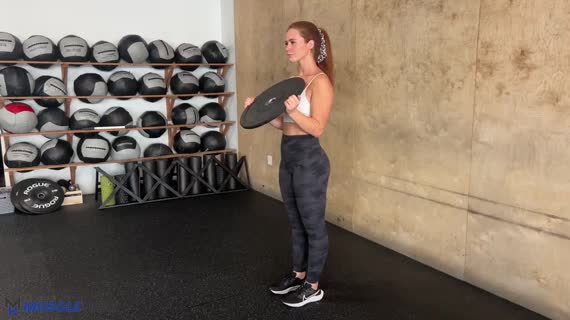
You are a GUI agent. You are given a task and a screenshot of the screen. Output one action in this format:
    pyautogui.click(x=<x>, y=<y>)
    Task: Click on the beige colored gym walls
    This screenshot has width=570, height=320.
    Given the screenshot: What is the action you would take?
    pyautogui.click(x=425, y=72), pyautogui.click(x=514, y=169), pyautogui.click(x=392, y=226), pyautogui.click(x=258, y=24), pyautogui.click(x=526, y=260)